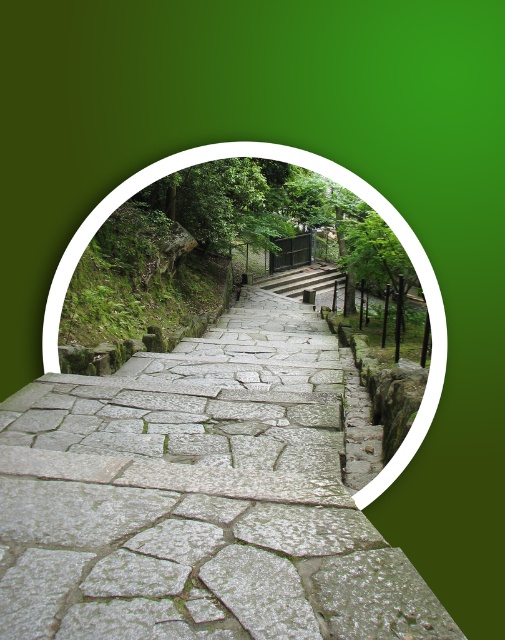
Question: Which point is closer to the camera?

Choices:
 (A) (19, 536)
 (B) (288, 156)

Answer: (A)

Question: Can you confirm if gray stone steps at center is positioned below gray stone stairs at center?

Choices:
 (A) yes
 (B) no

Answer: (A)

Question: Is gray stone stairs at center behind stone steps at center?

Choices:
 (A) yes
 (B) no

Answer: (B)

Question: Does gray stone stairs at center have a smaller size compared to stone steps at center?

Choices:
 (A) no
 (B) yes

Answer: (A)

Question: Based on their relative distances, which object is farther from the gray stone stairs at center?

Choices:
 (A) stone steps at center
 (B) gray stone steps at center

Answer: (A)

Question: Which of the following is the farthest from the observer?

Choices:
 (A) (304, 284)
 (B) (126, 372)
 (C) (397, 234)

Answer: (A)